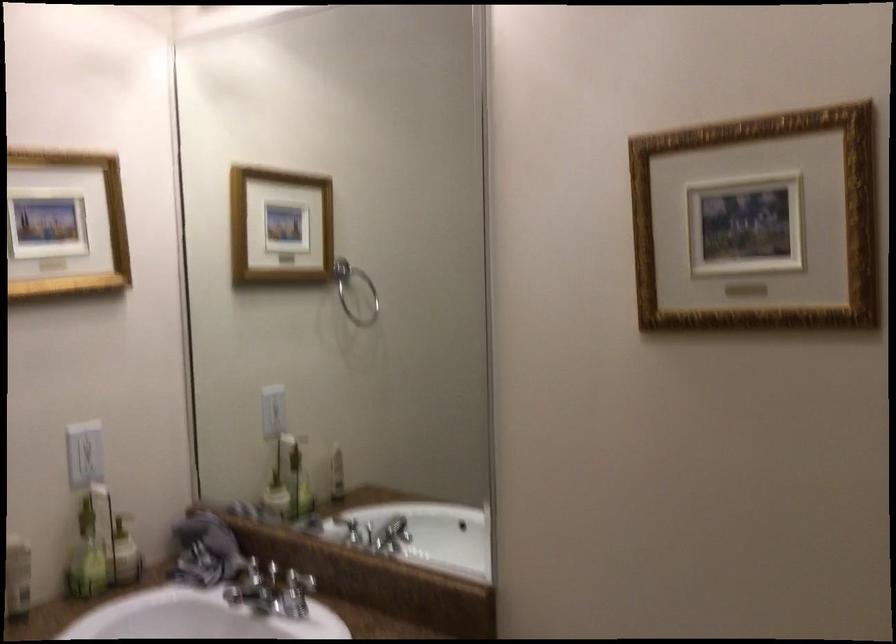
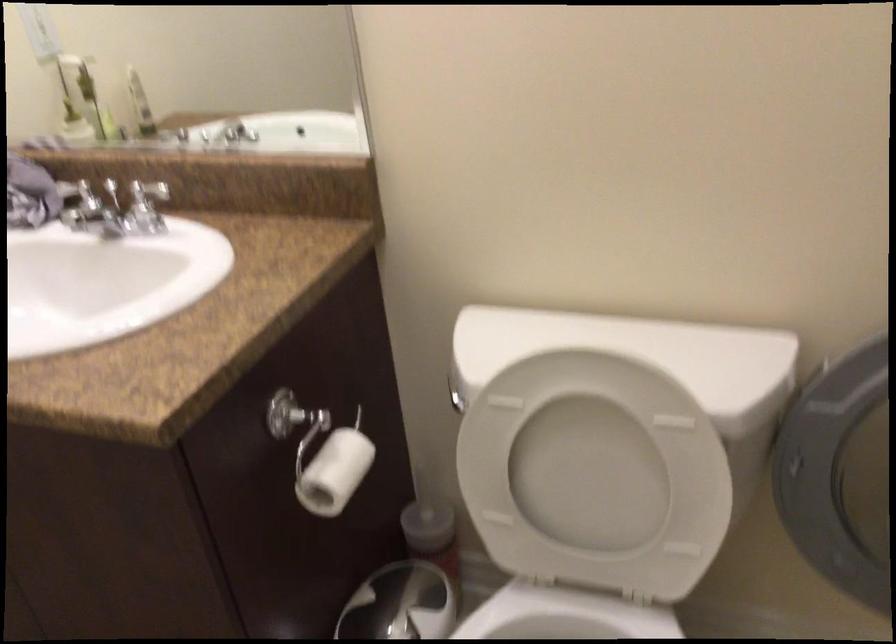
Locate, in the second image, the point that corresponds to [316,563] in the first image.

(156, 182)